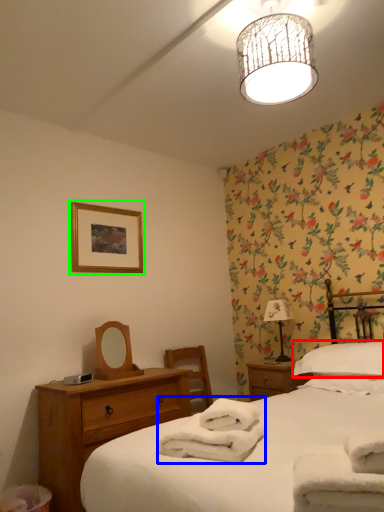
Question: Estimate the real-world distances between objects in this image. Which object is farther from pillow (highlighted by a red box), bath towel (highlighted by a blue box) or picture frame (highlighted by a green box)?

Choices:
 (A) bath towel
 (B) picture frame

Answer: (B)